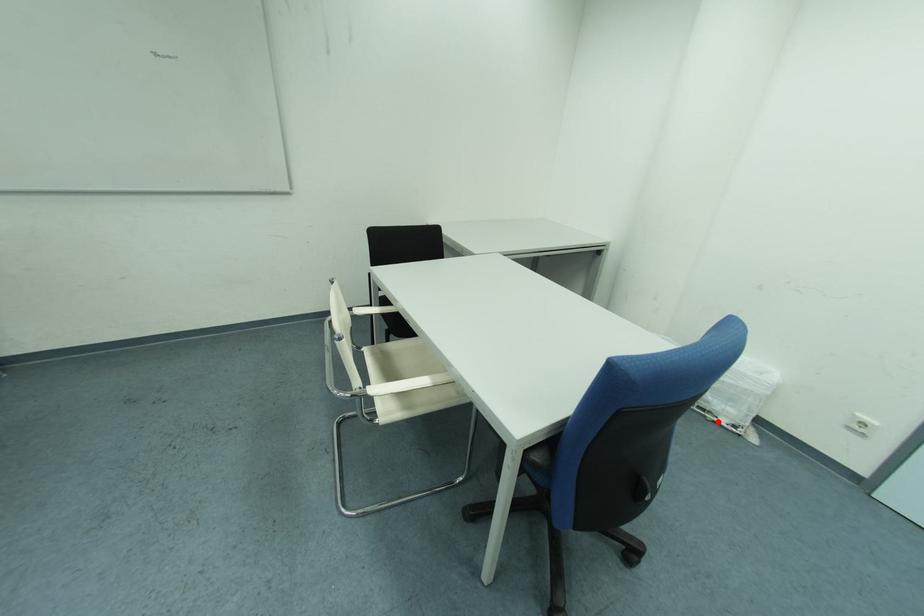
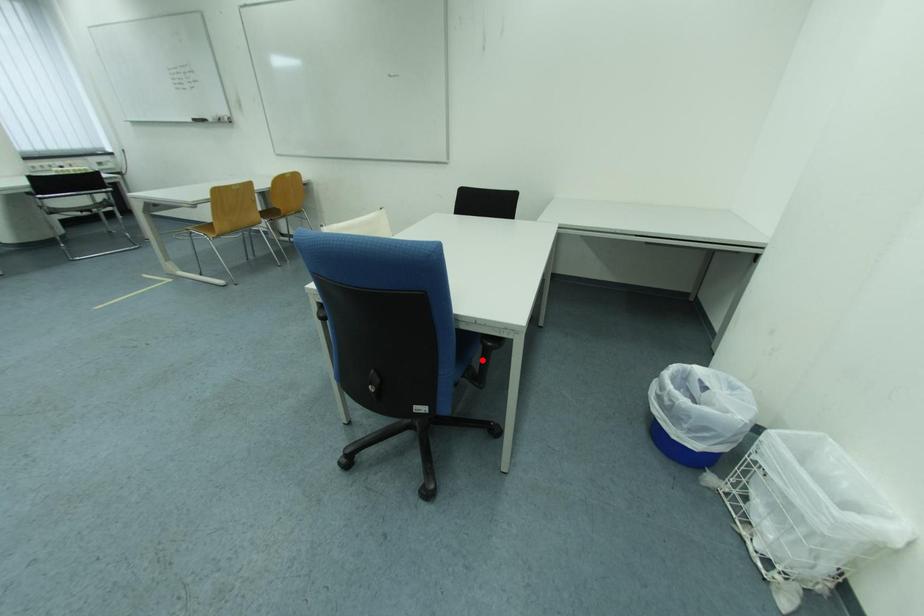
I am providing you with two images of the same scene from different viewpoints. A red point is marked on the first image and another point is marked on the second image. Does the point marked in image1 correspond to the same location as the one in image2?

No